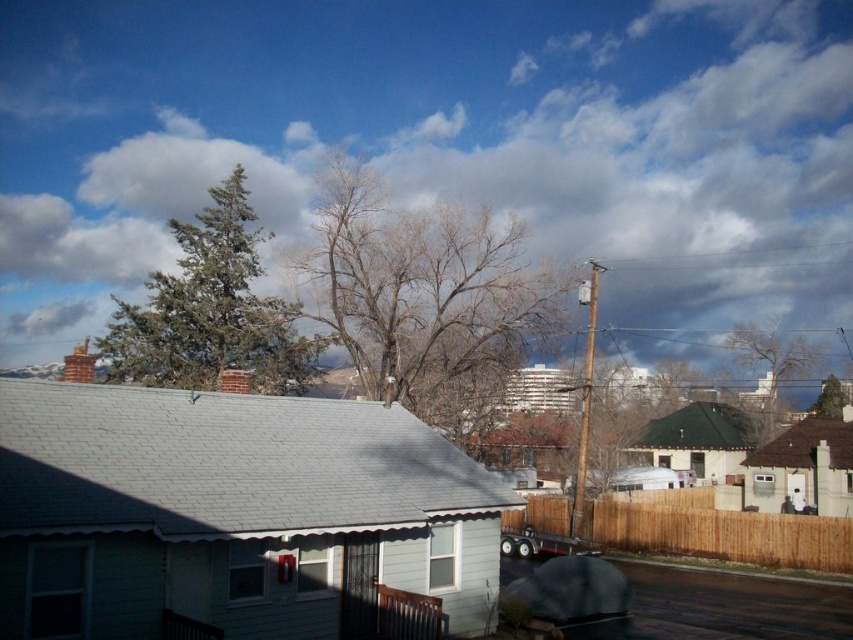
I want to click on bare branches at center, so click(425, 296).

Based on the photo, who is more forward, (x=310, y=314) or (x=218, y=204)?

Point (x=310, y=314)

Where is `bare branches at center`? This screenshot has width=853, height=640. bare branches at center is located at coordinates (425, 296).

Locate an element on the screen. bare branches at center is located at coordinates (425, 296).

Which of these two, green needle-like tree at upper left or bare branches at upper right, stands taller?

green needle-like tree at upper left is taller.

Does green needle-like tree at upper left appear under bare branches at upper right?

Incorrect, green needle-like tree at upper left is not positioned below bare branches at upper right.

Measure the distance between green needle-like tree at upper left and camera.

green needle-like tree at upper left and camera are 31.23 meters apart from each other.

Locate an element on the screen. The image size is (853, 640). green needle-like tree at upper left is located at coordinates (210, 308).

Who is more forward, (628, 284) or (218, 211)?

Point (218, 211) is in front.

Does point (546, 44) lie behind point (164, 320)?

Yes, point (546, 44) is farther from viewer.

Locate an element on the screen. white fluffy cloud at upper center is located at coordinates (436, 140).

At what (x,y) coordinates should I click in order to perform the action: click on white fluffy cloud at upper center. Please return your answer as a coordinate pair (x, y). The image size is (853, 640). Looking at the image, I should click on (436, 140).